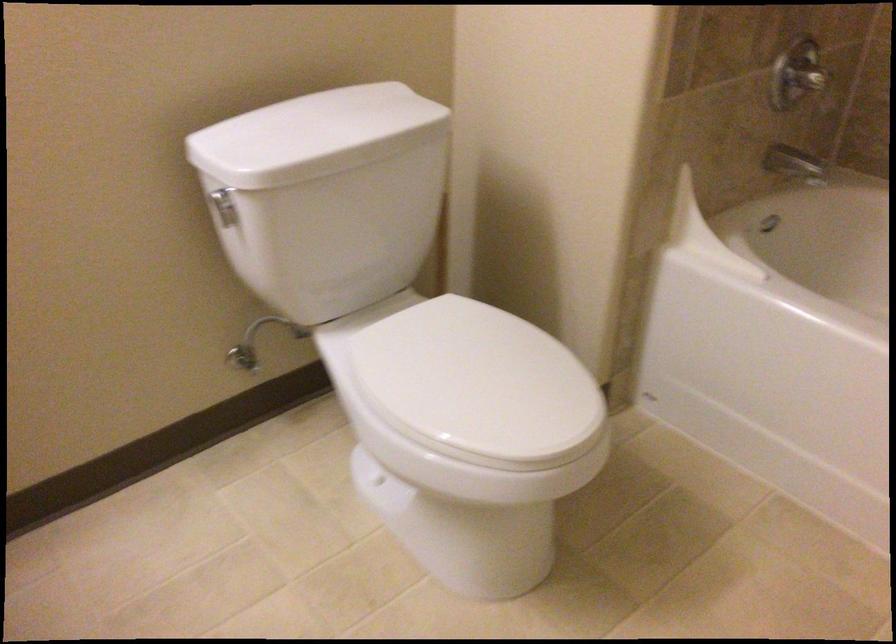
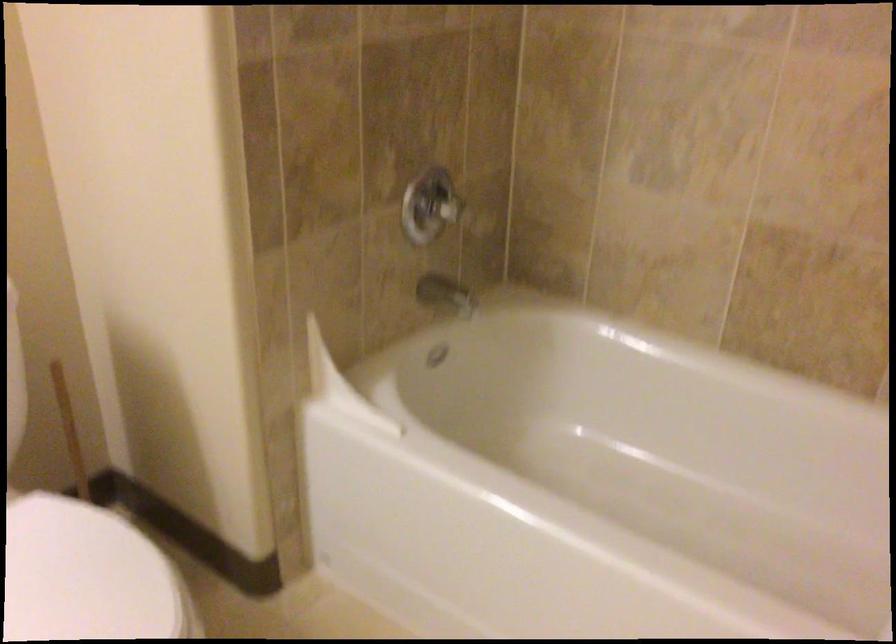
Where in the second image is the point corresponding to [506,351] from the first image?

(88, 576)